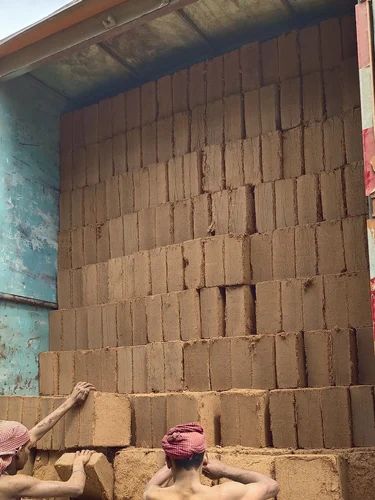
What are the coordinates of `blue wall` in the screenshot? It's located at (23, 338), (36, 157).